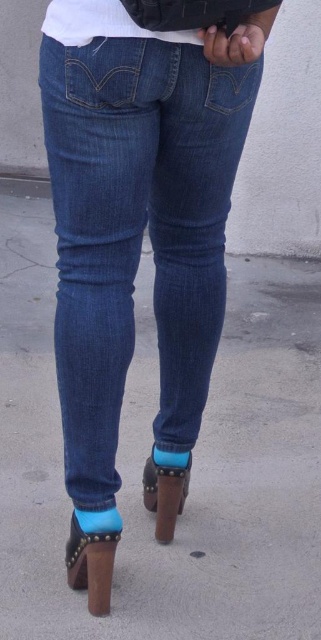
Can you confirm if denim at center is positioned below white matte shirt at upper center?

Correct, denim at center is located below white matte shirt at upper center.

Is point (103, 387) positioned after point (112, 32)?

Yes, it is.

Identify the location of denim at center. Image resolution: width=321 pixels, height=640 pixels. (137, 230).

Is point (176, 396) positioned before point (104, 580)?

That is False.

Does denim at center appear on the right side of leather/cowhide high-heeled sandal at lower center?

Indeed, denim at center is positioned on the right side of leather/cowhide high-heeled sandal at lower center.

Is point (153, 147) less distant than point (74, 518)?

Yes, it is.

What are the coordinates of `denim at center` in the screenshot? It's located at (137, 230).

Does leather/cowhide high-heeled sandal at lower center lie in front of brown leather sandal at lower center?

Yes, it is.

Locate an element on the screen. The image size is (321, 640). leather/cowhide high-heeled sandal at lower center is located at coordinates (90, 564).

This screenshot has width=321, height=640. I want to click on leather/cowhide high-heeled sandal at lower center, so click(90, 564).